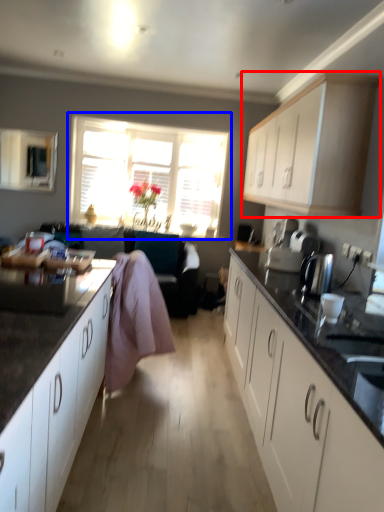
Question: Which of the following is the closest to the observer, cabinetry (highlighted by a red box) or window (highlighted by a blue box)?

Choices:
 (A) cabinetry
 (B) window

Answer: (A)